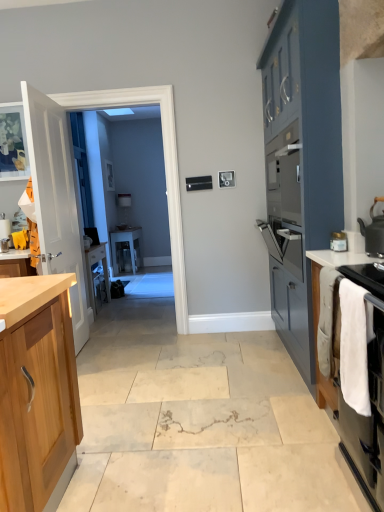
Question: Is clear glass door at center at the left side of white wood door at left?

Choices:
 (A) no
 (B) yes

Answer: (A)

Question: From a real-world perspective, is clear glass door at center located higher than white wood door at left?

Choices:
 (A) yes
 (B) no

Answer: (A)

Question: Is clear glass door at center shorter than white wood door at left?

Choices:
 (A) yes
 (B) no

Answer: (B)

Question: Is clear glass door at center positioned far away from white wood door at left?

Choices:
 (A) yes
 (B) no

Answer: (B)

Question: Is clear glass door at center to the right of white wood door at left from the viewer's perspective?

Choices:
 (A) yes
 (B) no

Answer: (A)

Question: Are clear glass door at center and white wood door at left beside each other?

Choices:
 (A) yes
 (B) no

Answer: (B)

Question: Considering the relative positions of white fabric towel at right and white wood door at left in the image provided, is white fabric towel at right behind white wood door at left?

Choices:
 (A) no
 (B) yes

Answer: (A)

Question: From the image's perspective, is white fabric towel at right under white wood door at left?

Choices:
 (A) no
 (B) yes

Answer: (B)

Question: Is white fabric towel at right oriented away from white wood door at left?

Choices:
 (A) yes
 (B) no

Answer: (B)

Question: Does white fabric towel at right have a greater height compared to white wood door at left?

Choices:
 (A) no
 (B) yes

Answer: (A)

Question: Does white fabric towel at right lie in front of white wood door at left?

Choices:
 (A) yes
 (B) no

Answer: (A)

Question: From a real-world perspective, is white fabric towel at right physically above white wood door at left?

Choices:
 (A) yes
 (B) no

Answer: (B)

Question: Is white glossy countertop at right positioned before clear glass table at center?

Choices:
 (A) yes
 (B) no

Answer: (A)